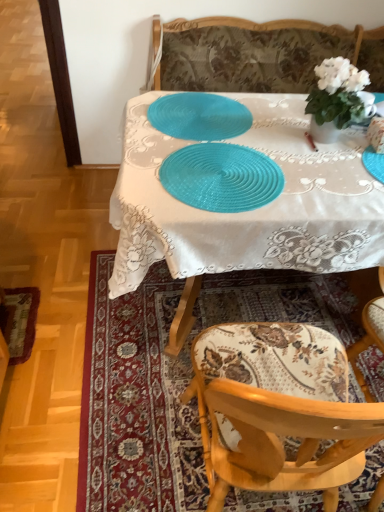
Question: Is teal plastic placemat at center, placed as the first tableware when sorted from back to front, thinner than teal woven placemat at center, marked as the 2th tableware in a top-to-bottom arrangement?

Choices:
 (A) yes
 (B) no

Answer: (A)

Question: Is teal plastic placemat at center, placed as the first tableware when sorted from back to front, at the right side of teal woven placemat at center, the second tableware viewed from the back?

Choices:
 (A) no
 (B) yes

Answer: (A)

Question: Does teal plastic placemat at center, which is the second tableware in front-to-back order, have a greater width compared to teal woven placemat at center, acting as the first tableware starting from the bottom?

Choices:
 (A) yes
 (B) no

Answer: (B)

Question: Considering the relative sizes of teal plastic placemat at center, placed as the first tableware when sorted from back to front, and teal woven placemat at center, acting as the first tableware starting from the bottom, in the image provided, is teal plastic placemat at center, placed as the first tableware when sorted from back to front, taller than teal woven placemat at center, acting as the first tableware starting from the bottom,?

Choices:
 (A) yes
 (B) no

Answer: (B)

Question: Considering the relative sizes of teal plastic placemat at center, which ranks as the 2th tableware in bottom-to-top order, and teal woven placemat at center, acting as the first tableware starting from the bottom, in the image provided, is teal plastic placemat at center, which ranks as the 2th tableware in bottom-to-top order, shorter than teal woven placemat at center, acting as the first tableware starting from the bottom,?

Choices:
 (A) no
 (B) yes

Answer: (B)

Question: From the image's perspective, relative to teal plastic placemat at center, placed as the first tableware when sorted from back to front, is wooden floral-patterned chair at lower right above or below?

Choices:
 (A) below
 (B) above

Answer: (A)

Question: Choose the correct answer: Is wooden floral-patterned chair at lower right inside teal plastic placemat at center, which is the second tableware in front-to-back order, or outside it?

Choices:
 (A) outside
 (B) inside

Answer: (A)

Question: Considering the positions of wooden floral-patterned chair at lower right and teal plastic placemat at center, which is the second tableware in front-to-back order, in the image, is wooden floral-patterned chair at lower right taller or shorter than teal plastic placemat at center, which is the second tableware in front-to-back order,?

Choices:
 (A) tall
 (B) short

Answer: (A)

Question: Considering their positions, is wooden floral-patterned chair at lower right located in front of or behind teal plastic placemat at center, which ranks as the first tableware in top-to-bottom order?

Choices:
 (A) front
 (B) behind

Answer: (A)

Question: Relative to wooden floral-patterned chair at lower right, is wooden chair at lower right in front or behind?

Choices:
 (A) front
 (B) behind

Answer: (B)

Question: From the image's perspective, relative to wooden floral-patterned chair at lower right, is wooden chair at lower right above or below?

Choices:
 (A) above
 (B) below

Answer: (B)

Question: Does point (86, 377) appear closer or farther from the camera than point (344, 441)?

Choices:
 (A) farther
 (B) closer

Answer: (A)

Question: From a real-world perspective, relative to wooden floral-patterned chair at lower right, is wooden chair at lower right vertically above or below?

Choices:
 (A) above
 (B) below

Answer: (B)

Question: From their relative heights in the image, would you say white glossy vase at upper right is taller or shorter than wooden floral-patterned chair at lower right?

Choices:
 (A) tall
 (B) short

Answer: (A)

Question: Is white glossy vase at upper right in front of or behind wooden floral-patterned chair at lower right in the image?

Choices:
 (A) front
 (B) behind

Answer: (B)